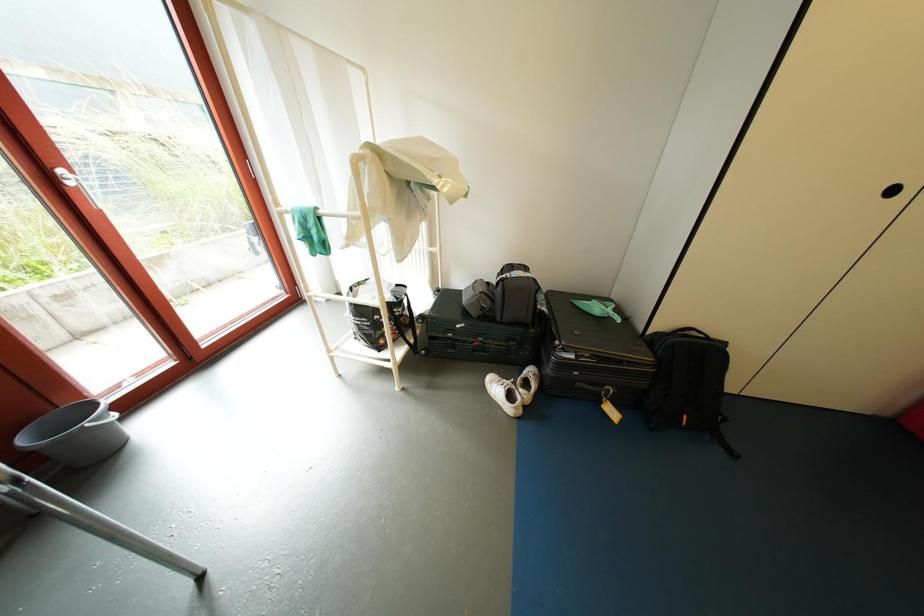
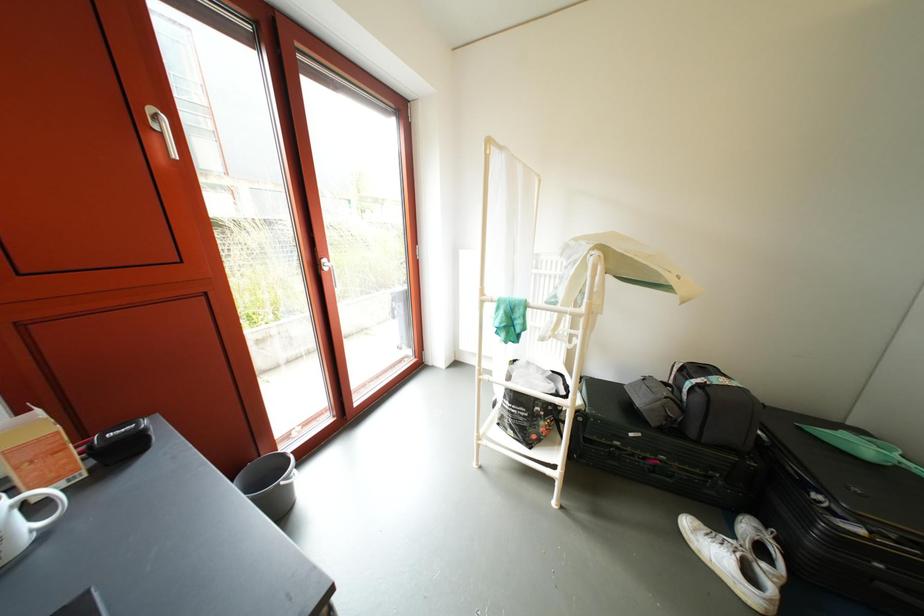
Question: The first image is from the beginning of the video and the second image is from the end. How did the camera likely rotate when shooting the video?

Choices:
 (A) Left
 (B) Right
 (C) Up
 (D) Down

Answer: (A)